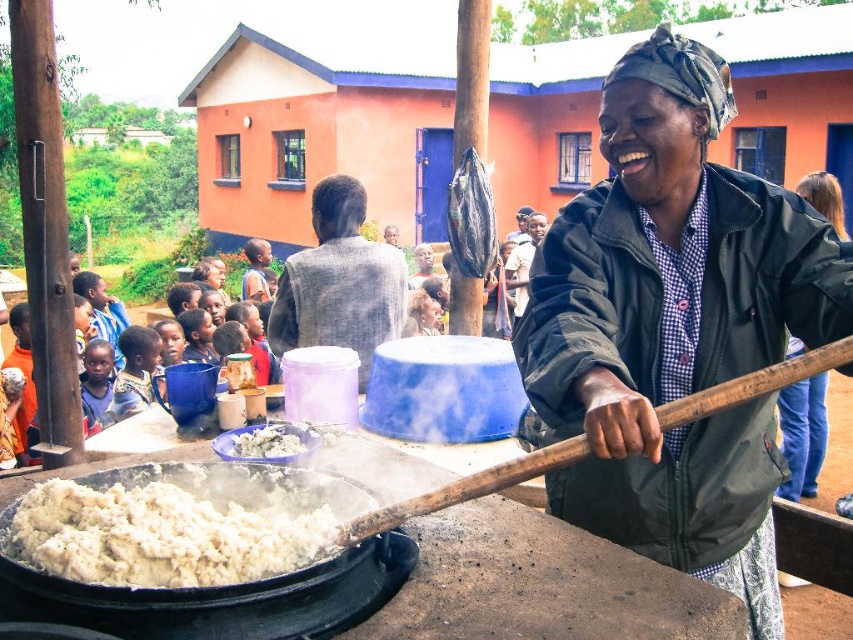
Question: Which is farther from the white fluffy food at center?

Choices:
 (A) matte black jacket at right
 (B) light brown skin at center

Answer: (A)

Question: Which object is the closest to the light brown skin at center?

Choices:
 (A) dark blue fabric shirt at left
 (B) white fluffy food at lower left
 (C) gray textured suit at center

Answer: (A)

Question: Does white fluffy food at center have a larger size compared to smooth gray shirt at center?

Choices:
 (A) yes
 (B) no

Answer: (B)

Question: Among these points, which one is nearest to the camera?

Choices:
 (A) (105, 388)
 (B) (53, 528)
 (C) (242, 436)

Answer: (B)

Question: Is green checkered shirt at center closer to the viewer compared to white fluffy food at lower left?

Choices:
 (A) yes
 (B) no

Answer: (A)

Question: Is white fluffy food at lower left wider than gray textured suit at center?

Choices:
 (A) no
 (B) yes

Answer: (A)